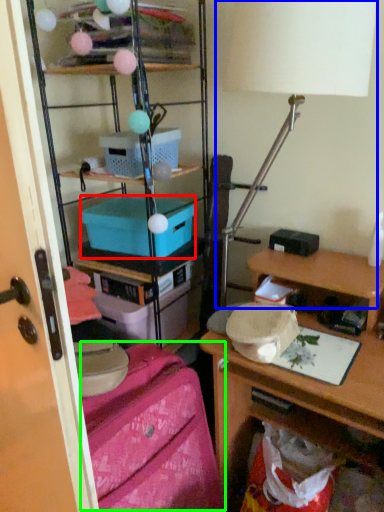
Question: Which object is positioned closest to box (highlighted by a red box)? Select from table lamp (highlighted by a blue box) and twin (highlighted by a green box).

Choices:
 (A) table lamp
 (B) twin

Answer: (A)